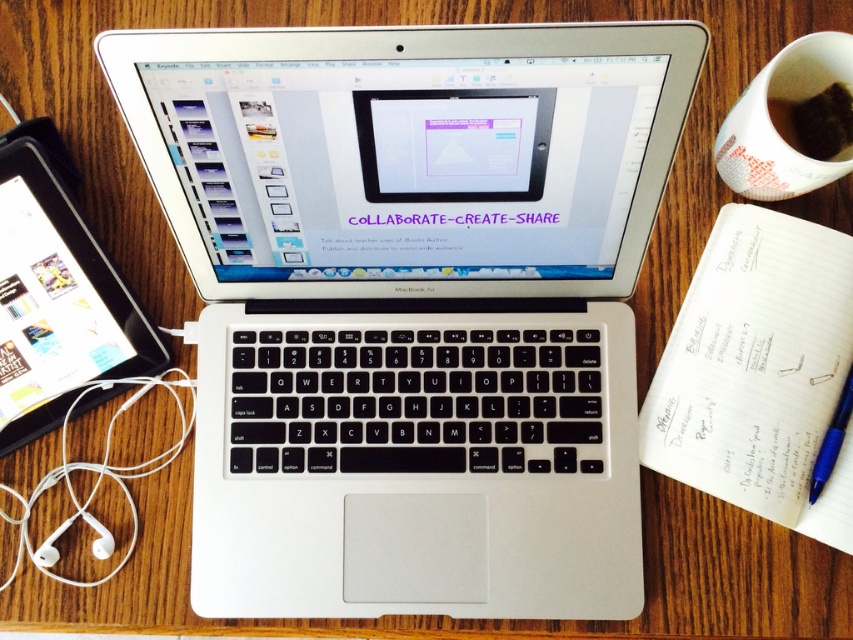
Question: Which object is closer to the camera taking this photo?

Choices:
 (A) white paper notepad at lower right
 (B) brown matte cup at upper right
 (C) white paper cup at upper right
 (D) black plastic tablet at left

Answer: (C)

Question: Is silver metallic laptop at center closer to the viewer compared to brown matte cup at upper right?

Choices:
 (A) yes
 (B) no

Answer: (A)

Question: Is silver metallic laptop at center closer to camera compared to white paper cup at upper right?

Choices:
 (A) yes
 (B) no

Answer: (A)

Question: Can you confirm if white paper notepad at lower right is positioned to the right of black plastic tablet at left?

Choices:
 (A) yes
 (B) no

Answer: (A)

Question: Which point is farther to the camera?

Choices:
 (A) [x=830, y=67]
 (B) [x=730, y=378]

Answer: (B)

Question: Which object appears closest to the camera in this image?

Choices:
 (A) white paper cup at upper right
 (B) black plastic tablet at left
 (C) white paper notepad at lower right

Answer: (A)